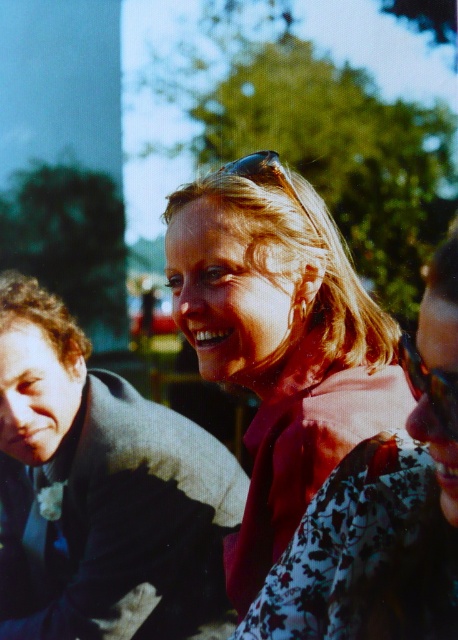
You are a photographer adjusting the camera settings to focus on the pink fabric at center and the clear plastic sunglasses at center. Which object should you adjust the focus towards first if you want to capture both in sharp detail?

The pink fabric at center is to the right of clear plastic sunglasses at center, so you should focus on the clear plastic sunglasses at center first, then adjust to the pink fabric at center to ensure both are in sharp detail.

You are standing in the park and see the woman in the light pink top at the center. Can you tell me where the point at coordinates (279, 340) is located?

The point at coordinates (279, 340) is located on the pink fabric at center, which is part of the woman in the light pink top.